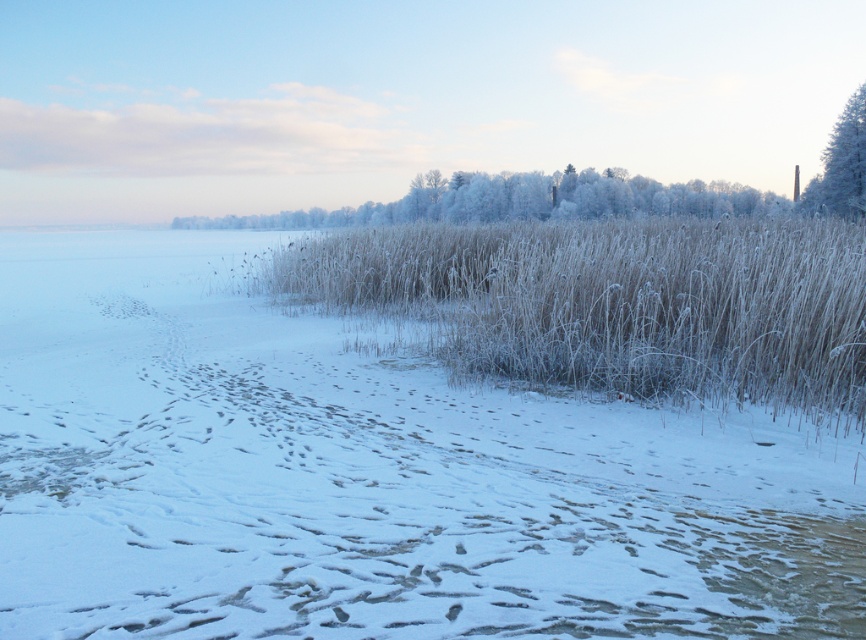
You are standing on the snowy path and want to reach the frosted grass at center. Which direction should you walk to avoid the white frosty tree at upper right?

The frosted grass at center is positioned under the white frosty tree at upper right, so to avoid the tree, you should walk to the left or right of the tree to reach the frosted grass at center.

You are standing at the edge of the frozen water on the left side of the image. You want to walk to the white frosty grass at center located at point (370,477). According to the scene description, will you have to walk over any footprints along the way?

The snowy path meanders through the scene leading towards the water edge, and the footprints are on the path. Since you are starting at the water edge and walking to the white frosty grass at center, you would be walking against the path direction, so you will have to walk over the footprints along the way.

Looking at this image, you are standing at the center of the snowy path and want to place a small decorative snowman exactly at the center of the image. According to the scene description, where should you place the snowman in relation to the white frosty grass at center?

The white frosty grass at center is already located at the center of the image, so you should place the snowman exactly where the white frosty grass at center is positioned.